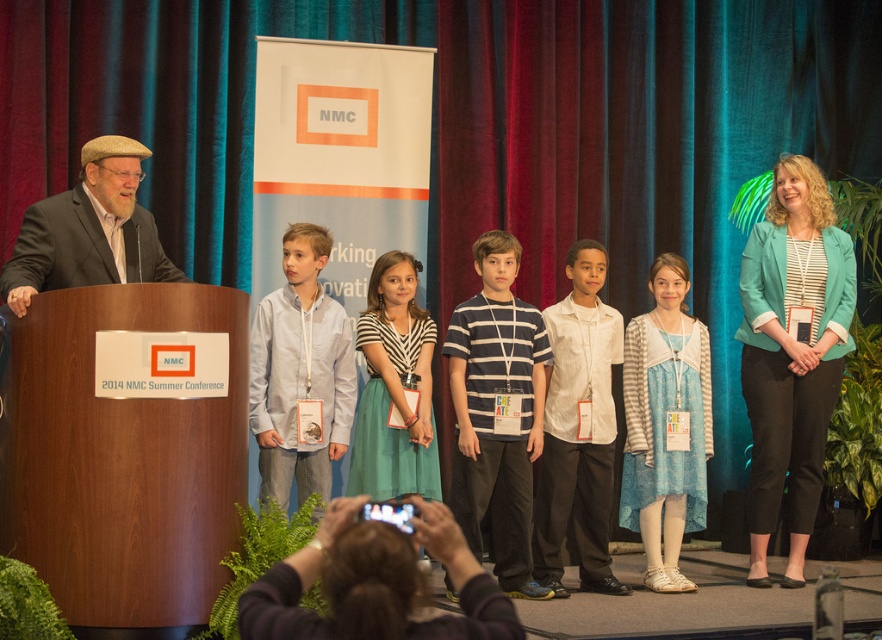
Question: Which point appears closest to the camera in this image?

Choices:
 (A) (430, 548)
 (B) (108, 150)

Answer: (A)

Question: Can you confirm if teal blazer at right is smaller than blue lace dress at center?

Choices:
 (A) no
 (B) yes

Answer: (A)

Question: Is teal blazer at right above black fabric camera at lower center?

Choices:
 (A) no
 (B) yes

Answer: (B)

Question: Is black fabric camera at lower center positioned before matte brown suit at left?

Choices:
 (A) no
 (B) yes

Answer: (B)

Question: Based on their relative distances, which object is nearer to the light blue shirt at center?

Choices:
 (A) matte brown suit at left
 (B) white striped shirt at center
 (C) black fabric camera at lower center

Answer: (A)

Question: Which of the following is the farthest from the observer?

Choices:
 (A) (270, 400)
 (B) (582, 572)
 (C) (776, 461)
 (D) (513, 376)

Answer: (B)